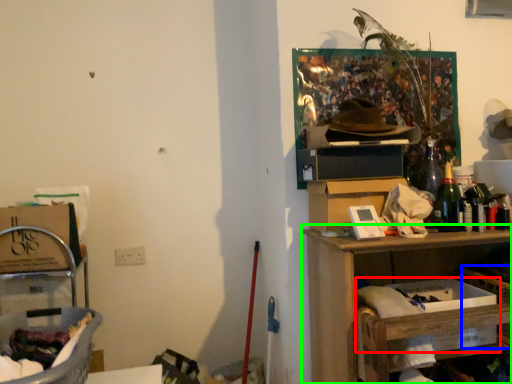
Question: Based on their relative distances, which object is farther from box (highlighted by a red box)? Choose from basket (highlighted by a blue box) and shelf (highlighted by a green box).

Choices:
 (A) basket
 (B) shelf

Answer: (B)